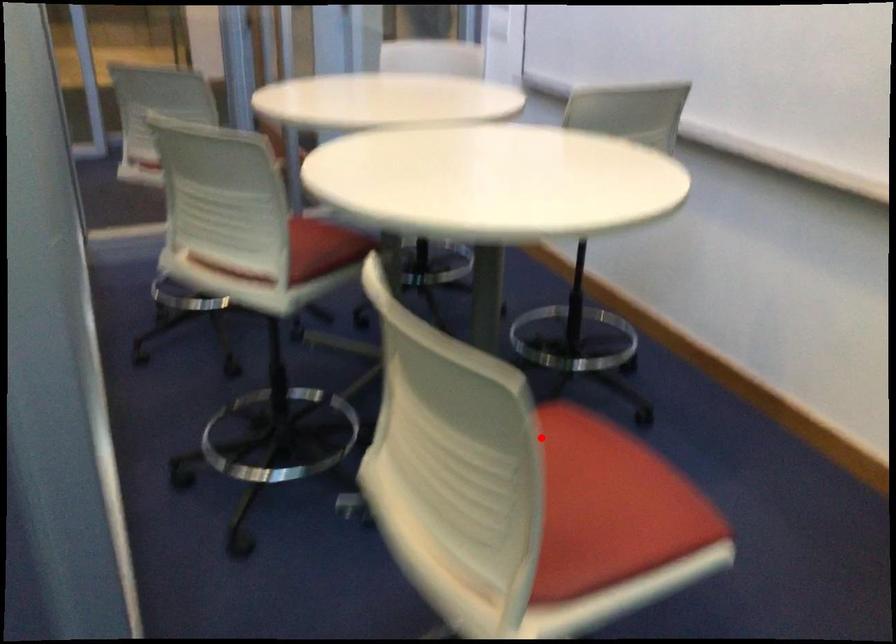
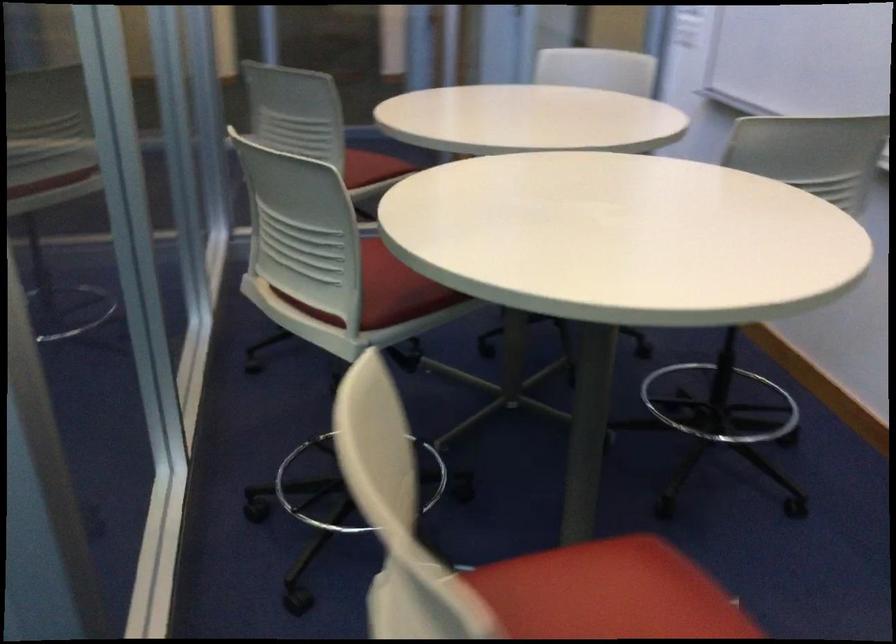
The point at the highlighted location is marked in the first image. Where is the corresponding point in the second image?

(608, 592)